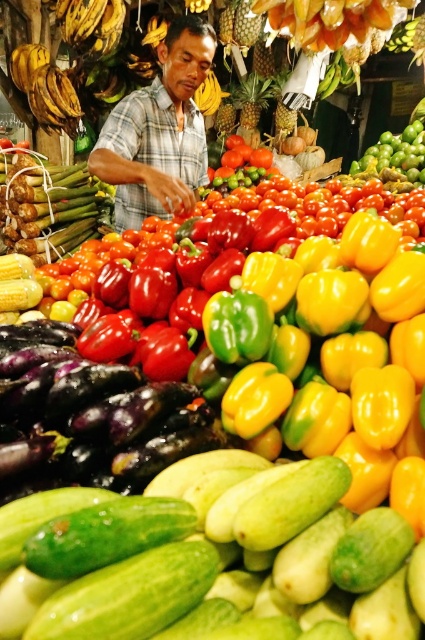
Which is in front, point (198, 600) or point (167, 99)?

Point (198, 600) is more forward.

The height and width of the screenshot is (640, 425). What do you see at coordinates (300, 540) in the screenshot?
I see `green smooth cucumber at center` at bounding box center [300, 540].

The height and width of the screenshot is (640, 425). In order to click on green smooth cucumber at center in this screenshot , I will do `click(300, 540)`.